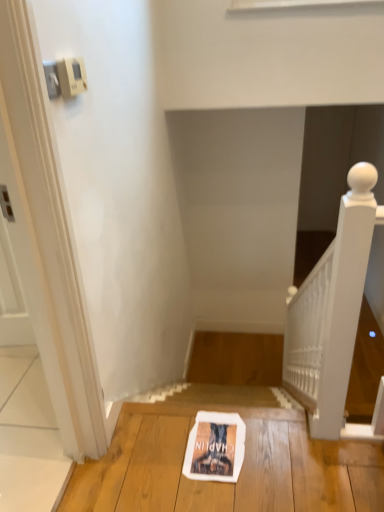
What do you see at coordinates (215, 447) in the screenshot? I see `white paper flyer at center` at bounding box center [215, 447].

In order to click on white paper flyer at center in this screenshot , I will do `click(215, 447)`.

This screenshot has width=384, height=512. Identify the location of white paper flyer at center. (215, 447).